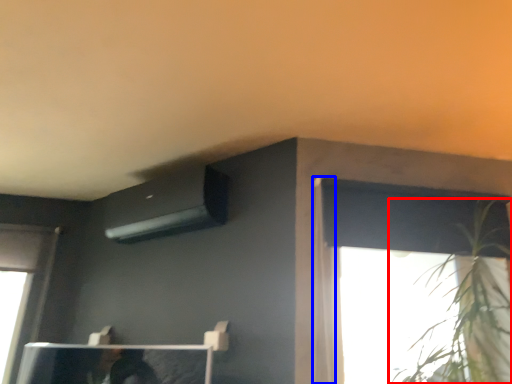
Question: Which of the following is the farthest to the observer, houseplant (highlighted by a red box) or curtain (highlighted by a blue box)?

Choices:
 (A) houseplant
 (B) curtain

Answer: (B)